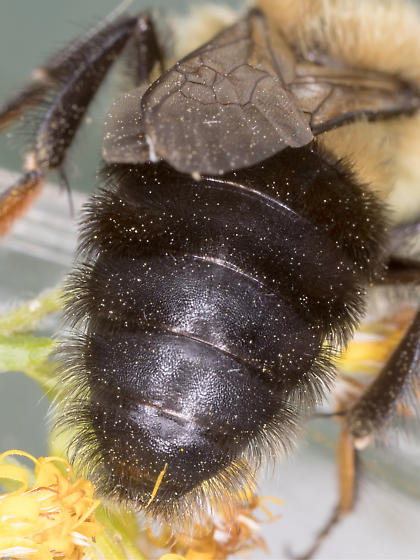
Locate an element on the screen. The width and height of the screenshot is (420, 560). leftmost leg is located at coordinates click(50, 70).